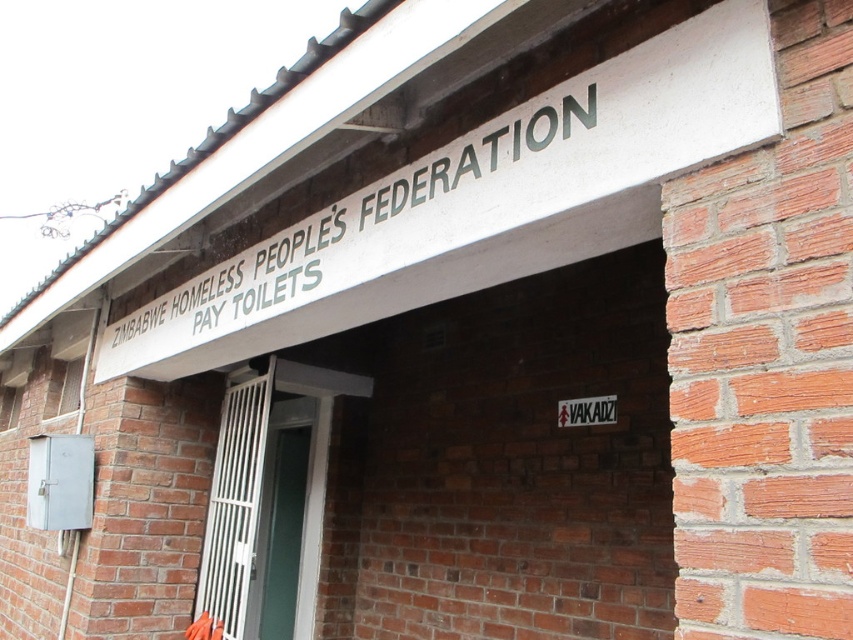
Based on the photo, which is below, white metallic sign at upper center or white metal gate at center?

white metal gate at center is lower down.

Is point (592, 220) positioned in front of point (238, 582)?

Yes, it is in front of point (238, 582).

You are a GUI agent. You are given a task and a screenshot of the screen. Output one action in this format:
    pyautogui.click(x=<x>, y=<y>)
    Task: Click on the white metallic sign at upper center
    This screenshot has width=853, height=640.
    Given the screenshot: What is the action you would take?
    (479, 204)

I want to click on white metallic sign at upper center, so click(x=479, y=204).